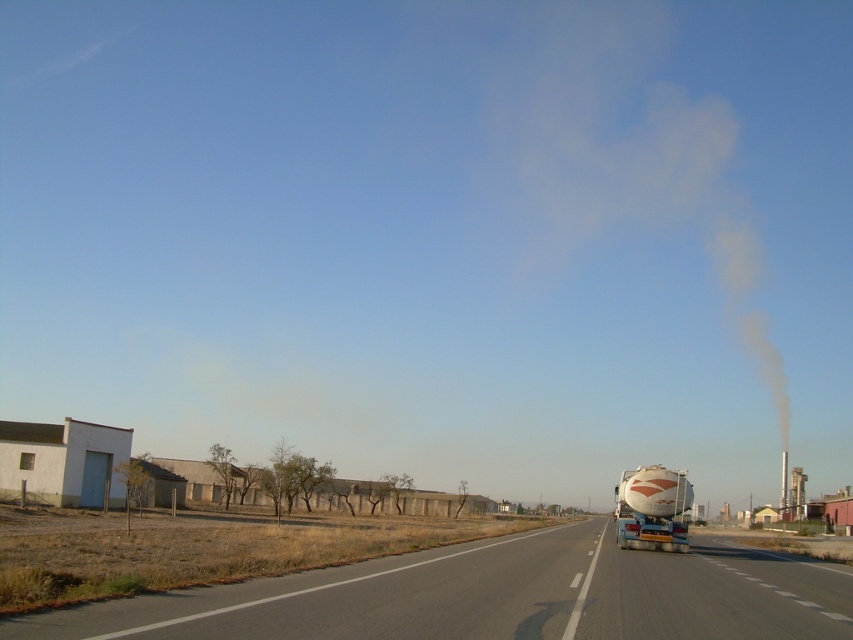
Does gray asphalt highway at center have a greater width compared to white glossy tanker at right?

Yes, gray asphalt highway at center is wider than white glossy tanker at right.

Between gray asphalt highway at center and white glossy tanker at right, which one is positioned lower?

gray asphalt highway at center is below.

Locate an element on the screen. This screenshot has height=640, width=853. gray asphalt highway at center is located at coordinates (495, 596).

The width and height of the screenshot is (853, 640). In order to click on gray asphalt highway at center in this screenshot , I will do `click(495, 596)`.